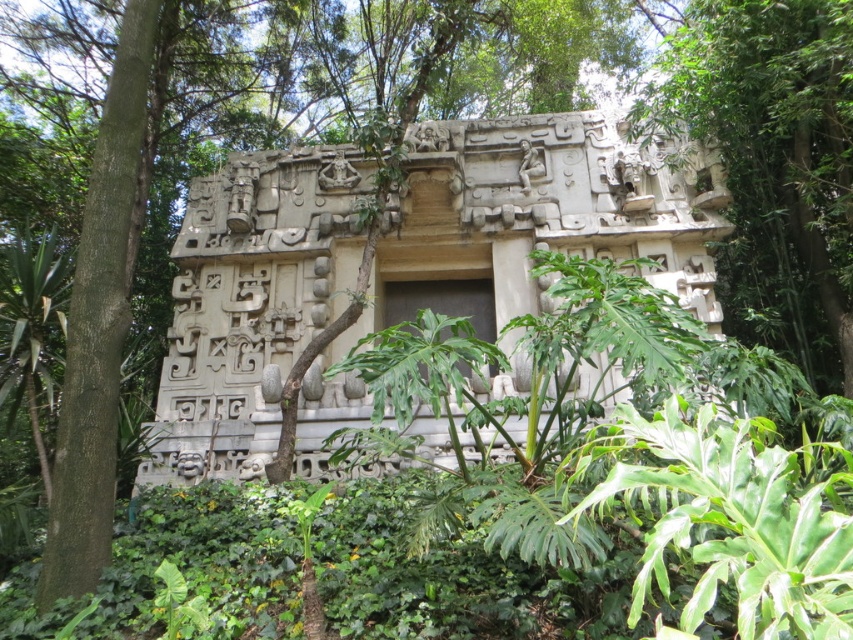
Is white stone carving at center to the left of green leafy plant at center from the viewer's perspective?

Yes, white stone carving at center is to the left of green leafy plant at center.

Which of these two, white stone carving at center or green leafy plant at center, stands shorter?

white stone carving at center

You are a GUI agent. You are given a task and a screenshot of the screen. Output one action in this format:
    pyautogui.click(x=<x>, y=<y>)
    Task: Click on the white stone carving at center
    The image size is (853, 640).
    Given the screenshot: What is the action you would take?
    pyautogui.click(x=519, y=234)